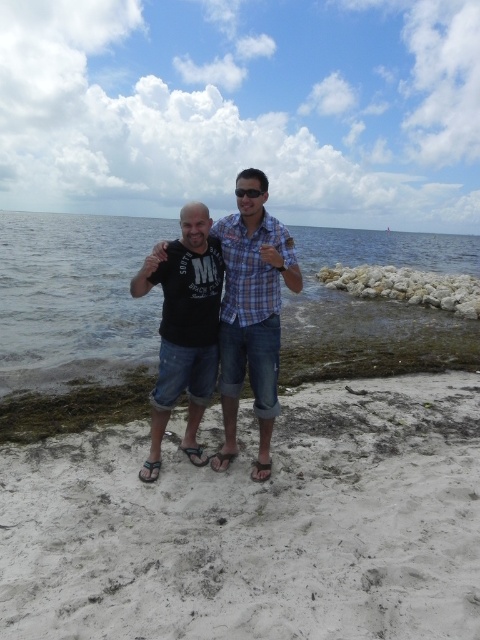
You are standing at point A located at coordinates (x=255, y=525) on the beach. Based on the scene description, what is the most likely type of terrain you would find at point A?

The point at coordinates (x=255, y=525) indicates a white sandy beach at center, so the terrain at point A is white sandy beach.